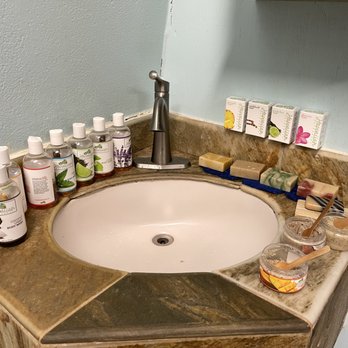
Where is `bathroom vanity`? This screenshot has width=348, height=348. bathroom vanity is located at coordinates (201, 303).